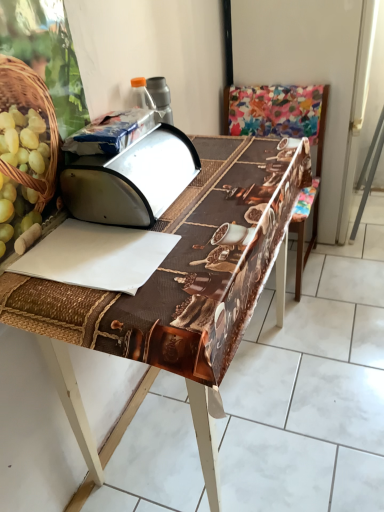
You are a GUI agent. You are given a task and a screenshot of the screen. Output one action in this format:
    pyautogui.click(x=<x>, y=<y>)
    Task: Click on the vacant area that lies in front of multicolored fabric chair at center
    This screenshot has height=512, width=384.
    Given the screenshot: What is the action you would take?
    pyautogui.click(x=332, y=322)